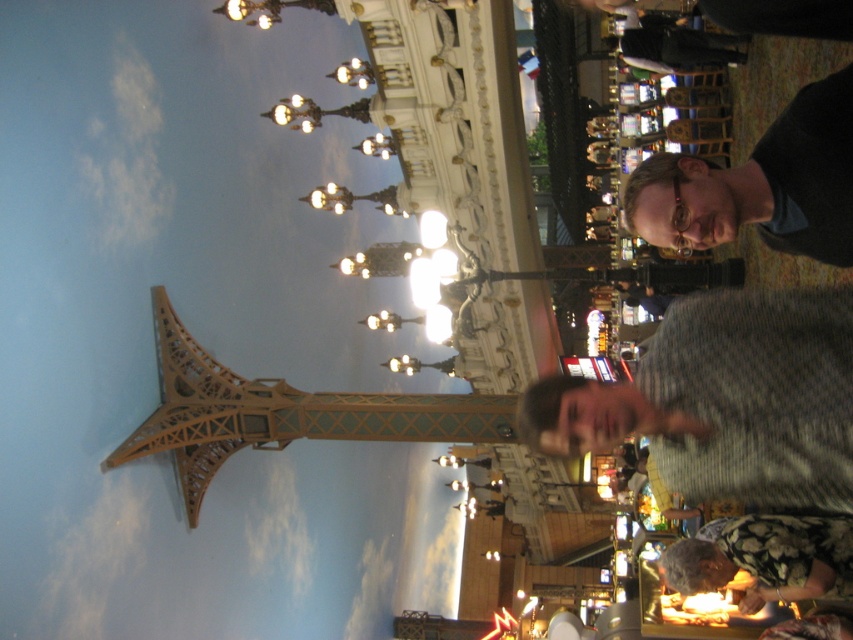
Question: Which object is the farthest from the matte black shirt at upper right?

Choices:
 (A) gray knitted sweater at lower right
 (B) floral-patterned fabric at lower right

Answer: (B)

Question: Among these objects, which one is farthest from the camera?

Choices:
 (A) gray knitted sweater at lower right
 (B) matte black shirt at upper right
 (C) floral-patterned fabric at lower right

Answer: (C)

Question: Considering the relative positions of gray knitted sweater at lower right and matte black shirt at upper right in the image provided, where is gray knitted sweater at lower right located with respect to matte black shirt at upper right?

Choices:
 (A) below
 (B) above

Answer: (A)

Question: Which of the following is the closest to the observer?

Choices:
 (A) (776, 566)
 (B) (730, 449)
 (C) (674, 209)

Answer: (B)

Question: Is gray knitted sweater at lower right to the left of floral-patterned fabric at lower right from the viewer's perspective?

Choices:
 (A) yes
 (B) no

Answer: (A)

Question: Can you confirm if matte black shirt at upper right is wider than floral-patterned fabric at lower right?

Choices:
 (A) yes
 (B) no

Answer: (A)